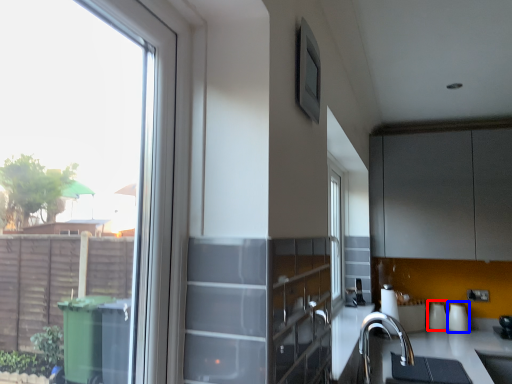
Question: Which object appears farthest to the camera in this image, appliance (highlighted by a red box) or appliance (highlighted by a blue box)?

Choices:
 (A) appliance
 (B) appliance

Answer: (A)